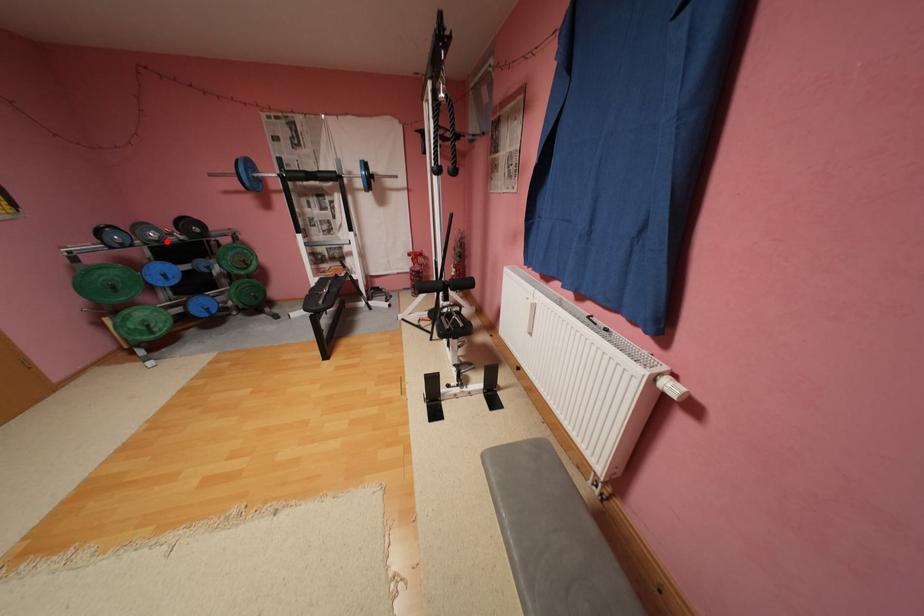
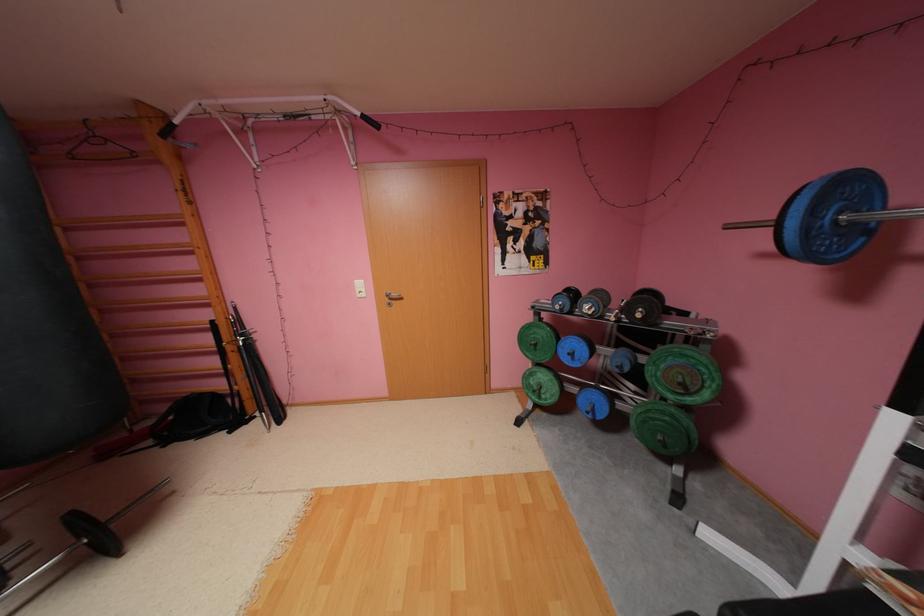
Locate, in the second image, the point that corresponds to the highlighted location in the first image.

(600, 315)